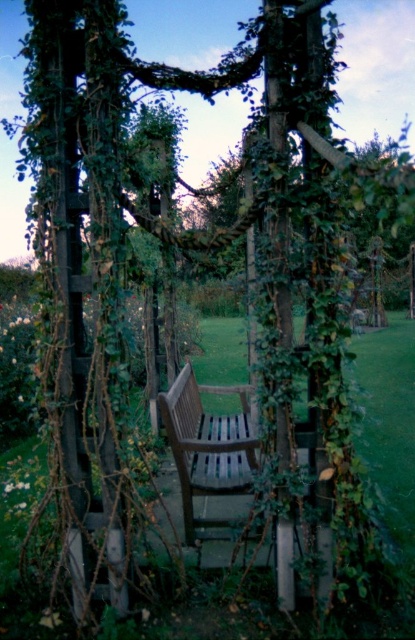
You are standing at the entrance of the wooden arbor and want to sit down on the bench. Which direction should you walk to reach the green grass at center?

You should walk forward towards the green grass at center located at point (390, 424), which is directly ahead of your position at the entrance.

Consider the image. You are planning to sit on the wooden bench at center in the garden. Based on the scene, will the green grass at center around the bench be a problem for sitting comfortably?

The green grass at center is much taller than the wooden bench at center, so the grass might obstruct or make sitting uncomfortable. It is recommended to trim the grass before sitting.